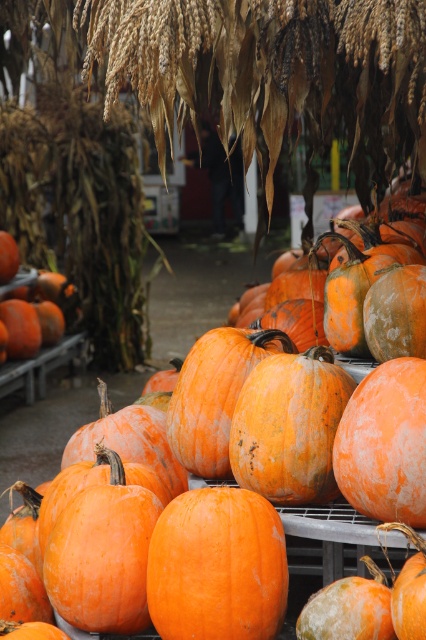
You are setting up a display for Halloween and need to stack the pumpkins vertically. Given that you have an orange matte pumpkin at center and an orange rough pumpkin at center, which one should you place at the bottom to ensure stability?

You should place the orange rough pumpkin at center at the bottom because it has a greater height than the orange matte pumpkin at center, providing a more stable base.

You are standing in front of a pumpkin display at a farm stand. You see an orange matte pumpkin at center and an orange rough pumpkin at center. Which pumpkin is closer to you?

The orange matte pumpkin at center is closer to you because it is positioned further to the viewer than the orange rough pumpkin at center.

From the picture: You are setting up a display for an autumn festival and need to arrange two pumpkins on a shelf. The shelf can only hold items that are no wider than 30 cm. You have an orange matte pumpkin at center and an orange rough pumpkin at center. Which pumpkin should you choose to ensure it fits on the shelf?

The orange matte pumpkin at center has a lesser width compared to the orange rough pumpkin at center, so the orange matte pumpkin at center is more likely to fit on the shelf that can only hold items no wider than 30 cm.